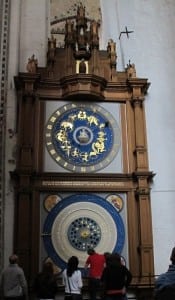
Locate an element on the screen. The height and width of the screenshot is (300, 175). plate is located at coordinates (119, 222).